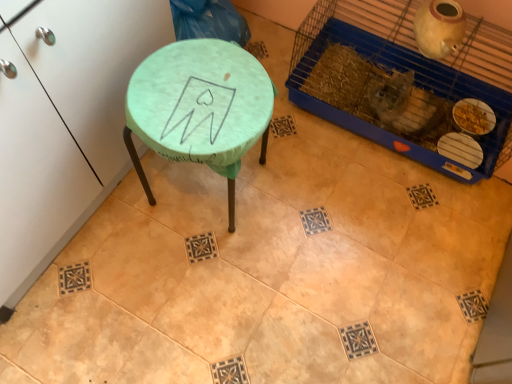
At what (x,y) coordinates should I click in order to perform the action: click on vacant space situated above matte green stool at center (from a real-world perspective). Please return your answer as a coordinate pair (x, y). The height and width of the screenshot is (384, 512). Looking at the image, I should click on (201, 90).